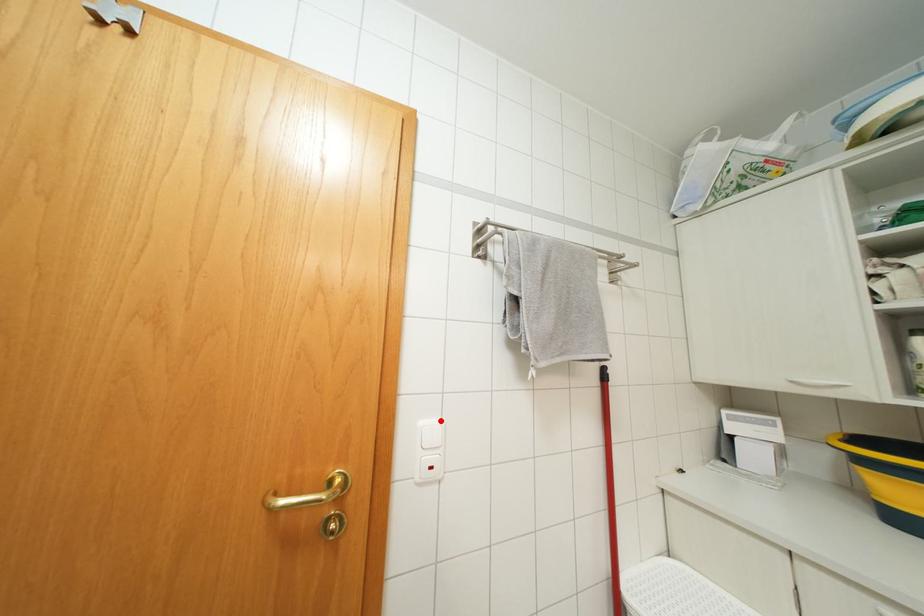
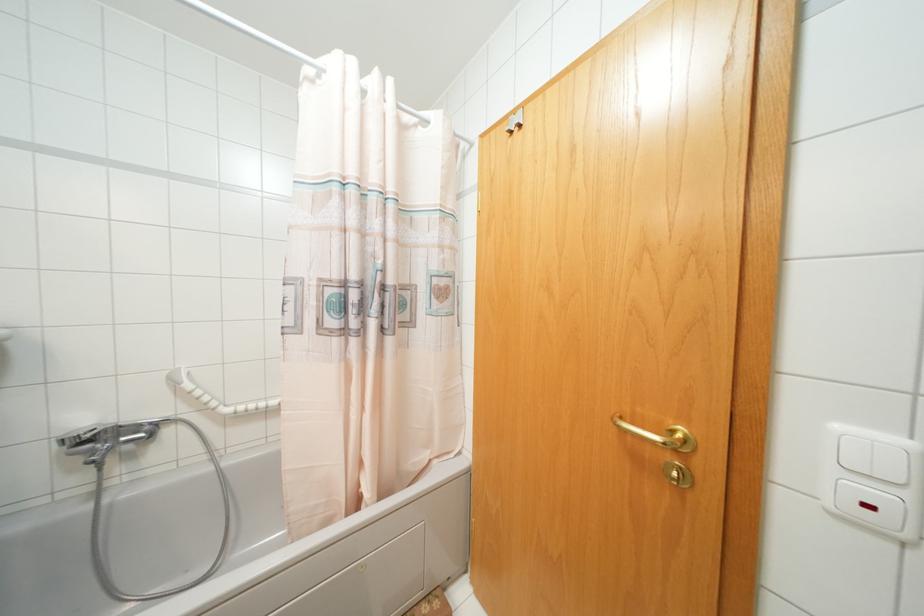
Find the pixel in the second image that matches the highlighted location in the first image.

(906, 442)